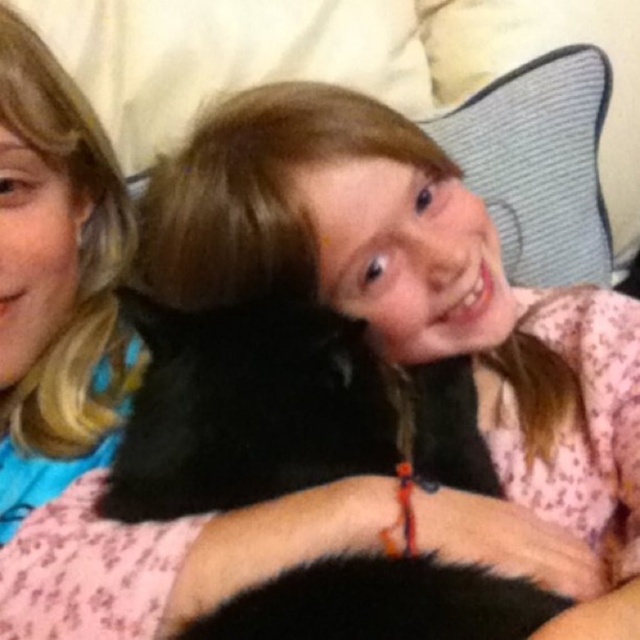
Is point (371, 372) positioned before point (536, 125)?

That is True.

Looking at this image, who is shorter, black fluffy cat at center or textured blue pillow at upper center?

With less height is black fluffy cat at center.

Is point (429, 384) positioned before point (584, 209)?

Yes.

Identify the location of black fluffy cat at center. (280, 410).